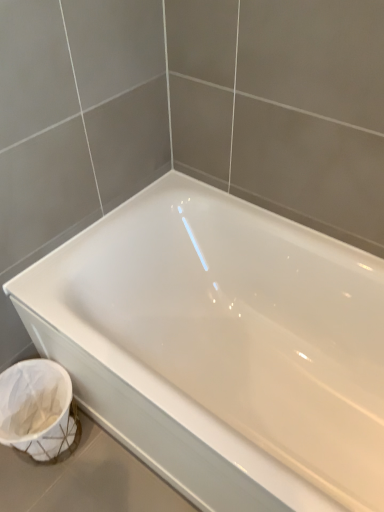
In order to face white glossy bathtub at center, should I rotate leftwards or rightwards?

To face it directly, rotate right by 6.034 degrees.

This screenshot has height=512, width=384. What do you see at coordinates (221, 347) in the screenshot? I see `white glossy bathtub at center` at bounding box center [221, 347].

What is the approximate width of white glossy bathtub at center?

white glossy bathtub at center is 69.69 centimeters in width.

Where is `white glossy bathtub at center`? The height and width of the screenshot is (512, 384). white glossy bathtub at center is located at coordinates (221, 347).

Locate an element on the screen. white woven laundry basket at lower left is located at coordinates (38, 410).

What do you see at coordinates (38, 410) in the screenshot? I see `white woven laundry basket at lower left` at bounding box center [38, 410].

At what (x,y) coordinates should I click in order to perform the action: click on white glossy bathtub at center. Please return your answer as a coordinate pair (x, y). The height and width of the screenshot is (512, 384). Looking at the image, I should click on (221, 347).

Which is more to the left, white glossy bathtub at center or white woven laundry basket at lower left?

From the viewer's perspective, white woven laundry basket at lower left appears more on the left side.

Is white glossy bathtub at center in front of or behind white woven laundry basket at lower left in the image?

Clearly, white glossy bathtub at center is in front of white woven laundry basket at lower left.

Which is behind, point (354, 496) or point (24, 376)?

The point (24, 376) is farther from the camera.

From the image's perspective, which one is positioned higher, white glossy bathtub at center or white woven laundry basket at lower left?

white glossy bathtub at center, from the image's perspective.

From a real-world perspective, between white glossy bathtub at center and white woven laundry basket at lower left, who is vertically higher?

white glossy bathtub at center, from a real-world perspective.

Considering the relative sizes of white glossy bathtub at center and white woven laundry basket at lower left in the image provided, is white glossy bathtub at center thinner than white woven laundry basket at lower left?

In fact, white glossy bathtub at center might be wider than white woven laundry basket at lower left.

Considering the sizes of objects white glossy bathtub at center and white woven laundry basket at lower left in the image provided, who is taller, white glossy bathtub at center or white woven laundry basket at lower left?

Standing taller between the two is white glossy bathtub at center.

Based on their sizes in the image, would you say white glossy bathtub at center is bigger or smaller than white woven laundry basket at lower left?

Considering their sizes, white glossy bathtub at center takes up more space than white woven laundry basket at lower left.

Is white glossy bathtub at center outside of white woven laundry basket at lower left?

Absolutely, white glossy bathtub at center is external to white woven laundry basket at lower left.

Does white glossy bathtub at center touch white woven laundry basket at lower left?

No, white glossy bathtub at center is not making contact with white woven laundry basket at lower left.

Is white glossy bathtub at center oriented away from white woven laundry basket at lower left?

white glossy bathtub at center is not turned away from white woven laundry basket at lower left.

How different are the orientations of white glossy bathtub at center and white woven laundry basket at lower left in degrees?

The angular difference between white glossy bathtub at center and white woven laundry basket at lower left is 0.423 degrees.

At what (x,y) coordinates should I click in order to perform the action: click on laundry basket behind the white glossy bathtub at center. Please return your answer as a coordinate pair (x, y). Looking at the image, I should click on (38, 410).

Considering the positions of objects white woven laundry basket at lower left and white glossy bathtub at center in the image provided, who is more to the left, white woven laundry basket at lower left or white glossy bathtub at center?

Positioned to the left is white woven laundry basket at lower left.

From the picture: Between white woven laundry basket at lower left and white glossy bathtub at center, which one is positioned in front?

Positioned in front is white glossy bathtub at center.

Considering the positions of point (34, 394) and point (209, 313), is point (34, 394) closer or farther from the camera than point (209, 313)?

Clearly, point (34, 394) is closer to the camera than point (209, 313).

From the image's perspective, relative to white glossy bathtub at center, is white woven laundry basket at lower left above or below?

white woven laundry basket at lower left is below white glossy bathtub at center.

Consider the image. From a real-world perspective, is white woven laundry basket at lower left located beneath white glossy bathtub at center?

Yes, from a real-world perspective, white woven laundry basket at lower left is under white glossy bathtub at center.

Which of these two, white woven laundry basket at lower left or white glossy bathtub at center, is thinner?

Thinner between the two is white woven laundry basket at lower left.

Is white woven laundry basket at lower left taller or shorter than white glossy bathtub at center?

Clearly, white woven laundry basket at lower left is shorter compared to white glossy bathtub at center.

Which of these two, white woven laundry basket at lower left or white glossy bathtub at center, is bigger?

white glossy bathtub at center is bigger.

Is white woven laundry basket at lower left positioned beyond the bounds of white glossy bathtub at center?

Indeed, white woven laundry basket at lower left is completely outside white glossy bathtub at center.

Is the surface of white woven laundry basket at lower left in direct contact with white glossy bathtub at center?

No.

Is white woven laundry basket at lower left oriented towards white glossy bathtub at center?

No, white woven laundry basket at lower left is not facing towards white glossy bathtub at center.

Identify the location of laundry basket on the left of white glossy bathtub at center. (38, 410).

Locate an element on the screen. The height and width of the screenshot is (512, 384). bathtub that is above the white woven laundry basket at lower left (from a real-world perspective) is located at coordinates (221, 347).

Locate an element on the screen. This screenshot has height=512, width=384. bathtub in front of the white woven laundry basket at lower left is located at coordinates (221, 347).